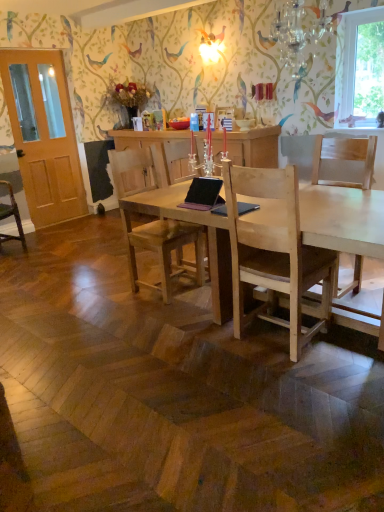
The height and width of the screenshot is (512, 384). I want to click on vacant region to the left of pink leather laptop at center, so [170, 206].